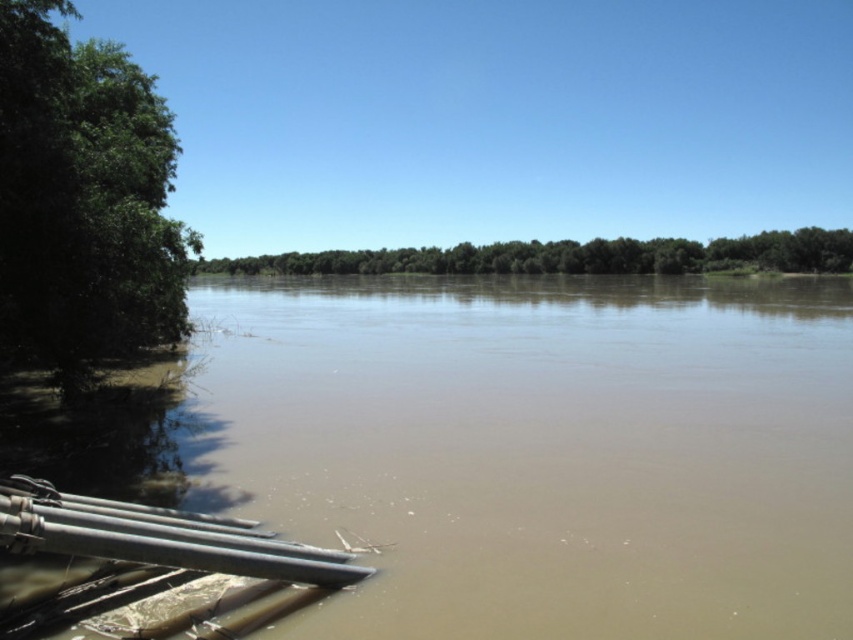
Which is in front, point (749, 406) or point (21, 177)?

Positioned in front is point (21, 177).

Can you confirm if brown muddy water at lower left is taller than green leafy tree at left?

→ Incorrect, brown muddy water at lower left's height is not larger of green leafy tree at left's.

Between point (633, 561) and point (27, 339), which one is positioned behind?

The point (27, 339) is more distant.

Locate an element on the screen. The height and width of the screenshot is (640, 853). brown muddy water at lower left is located at coordinates (538, 449).

Is green leafy trees at center to the left of matte gray water pipe at lower left from the viewer's perspective?

Correct, you'll find green leafy trees at center to the left of matte gray water pipe at lower left.

Is green leafy trees at center shorter than matte gray water pipe at lower left?

Incorrect, green leafy trees at center's height does not fall short of matte gray water pipe at lower left's.

This screenshot has height=640, width=853. Identify the location of green leafy trees at center. (572, 257).

Is the position of brown muddy water at lower left less distant than that of green leafy trees at center?

Yes, brown muddy water at lower left is closer to the viewer.

Which is more to the right, brown muddy water at lower left or green leafy trees at center?

brown muddy water at lower left is more to the right.

The width and height of the screenshot is (853, 640). What do you see at coordinates (538, 449) in the screenshot? I see `brown muddy water at lower left` at bounding box center [538, 449].

Where is `brown muddy water at lower left`? This screenshot has width=853, height=640. brown muddy water at lower left is located at coordinates (538, 449).